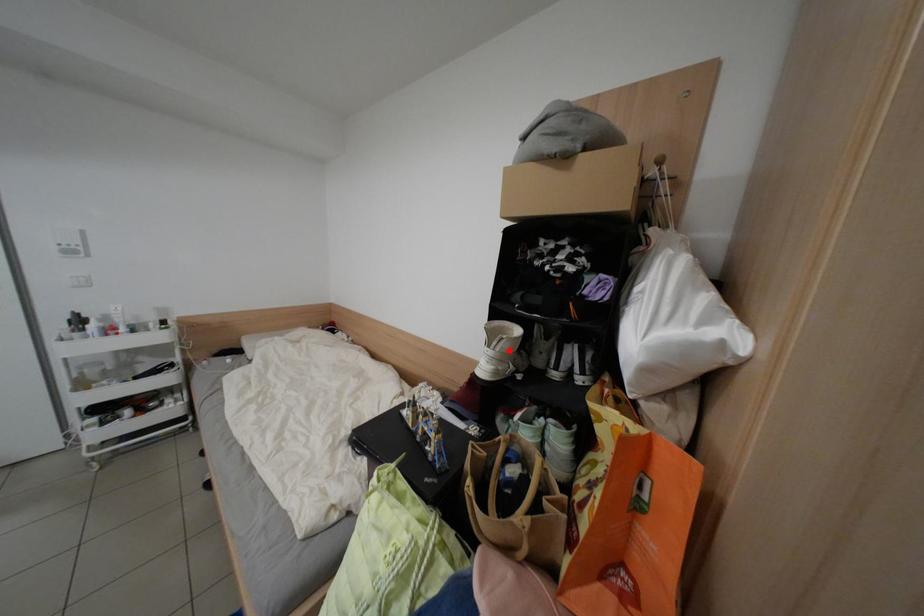
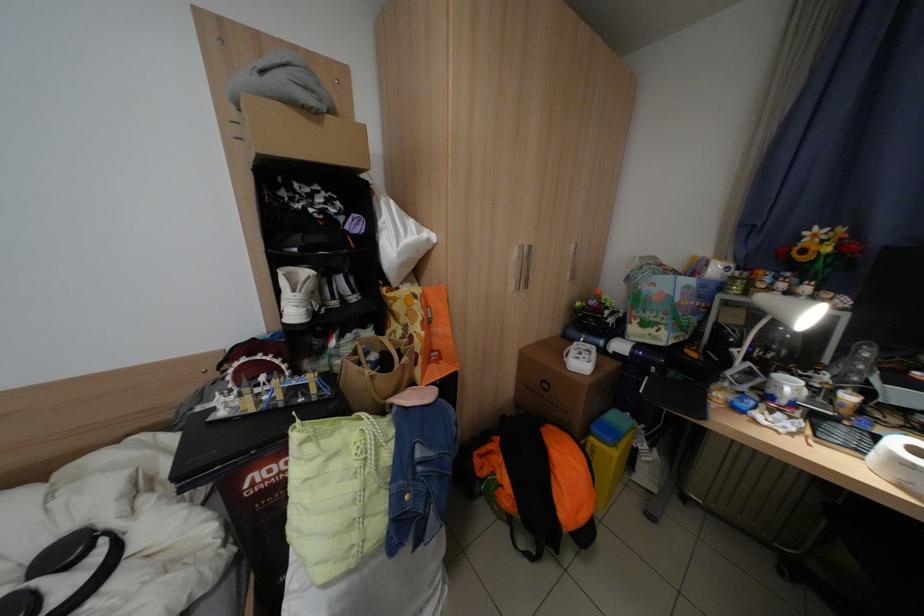
Question: I am providing you with two images of the same scene from different viewpoints. Given a red point in image1, look at the same physical point in image2. Is it:

Choices:
 (A) Closer to the viewpoint
 (B) Farther from the viewpoint

Answer: (A)